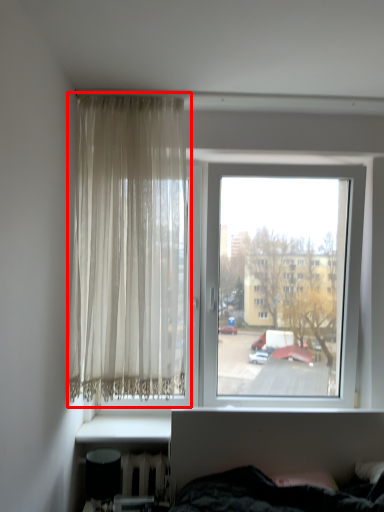
Question: From the image's perspective, what is the correct spatial positioning of curtain (annotated by the red box) in reference to window?

Choices:
 (A) above
 (B) below

Answer: (A)